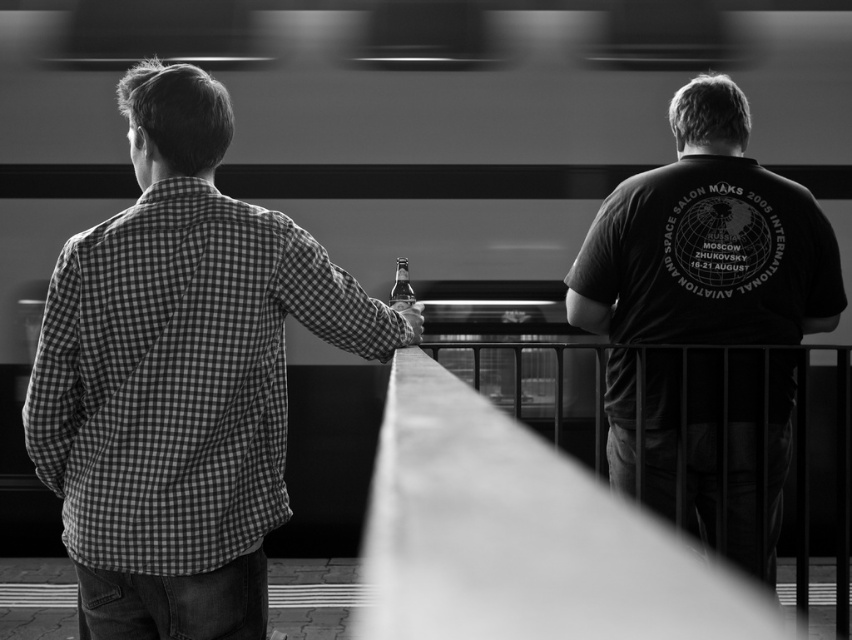
Question: Based on their relative distances, which object is nearer to the translucent glass bottle at center?

Choices:
 (A) dark gray t-shirt at center
 (B) checkered fabric shirt at left

Answer: (A)

Question: Where is checkered fabric shirt at left located in relation to dark gray t-shirt at center in the image?

Choices:
 (A) right
 (B) left

Answer: (B)

Question: Can you confirm if checkered fabric shirt at left is smaller than dark gray t-shirt at center?

Choices:
 (A) yes
 (B) no

Answer: (B)

Question: Which object is closer to the camera taking this photo?

Choices:
 (A) dark gray t-shirt at center
 (B) translucent glass bottle at center

Answer: (B)

Question: Based on their relative distances, which object is nearer to the checkered fabric shirt at left?

Choices:
 (A) dark gray t-shirt at center
 (B) translucent glass bottle at center

Answer: (B)

Question: Is checkered fabric shirt at left smaller than dark gray t-shirt at center?

Choices:
 (A) no
 (B) yes

Answer: (A)